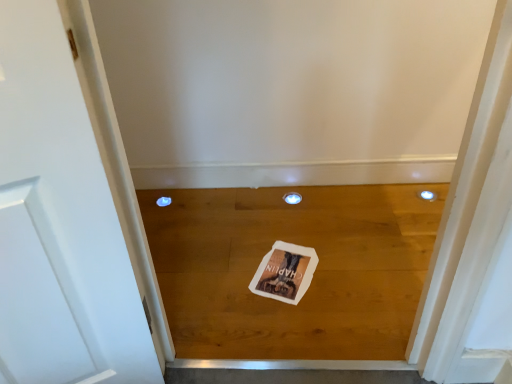
Locate an element on the screen. This screenshot has width=512, height=384. free space to the left of white paper postcard at center is located at coordinates (223, 270).